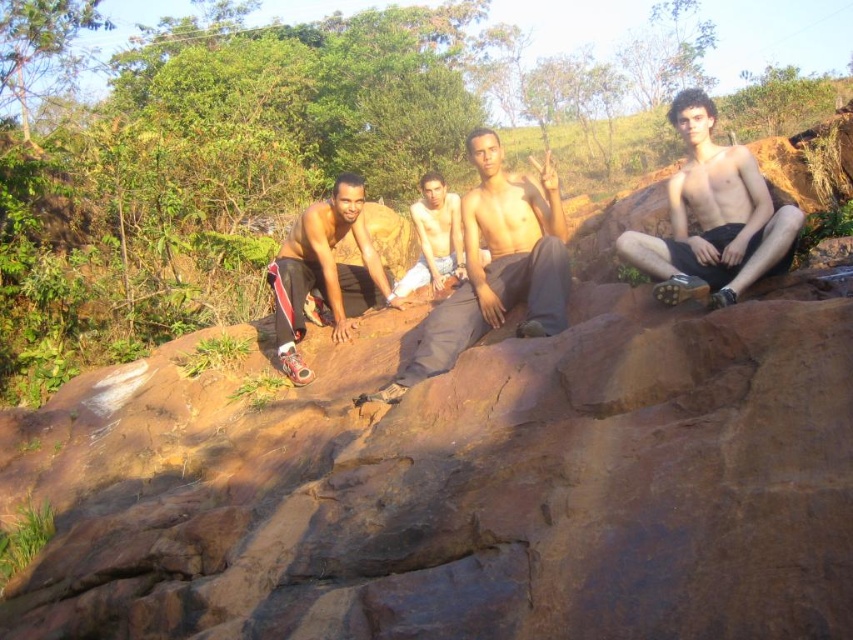
You are a photographer planning to capture a group photo of the four men sitting on the brown rough rock at center and near the shiny black shorts at left. Based on the scene, which object takes up more horizontal space?

The brown rough rock at center takes up more horizontal space than the shiny black shorts at left because its width is larger.

You are a photographer trying to capture a closeup of the shiny black shorts at right. To do this, you need to ensure that the brown rough rock at center doesn t block the view. Is the rock currently blocking the shorts?

The brown rough rock at center is positioned under shiny black shorts at right, so the rock is blocking the shorts and obstructing the view.